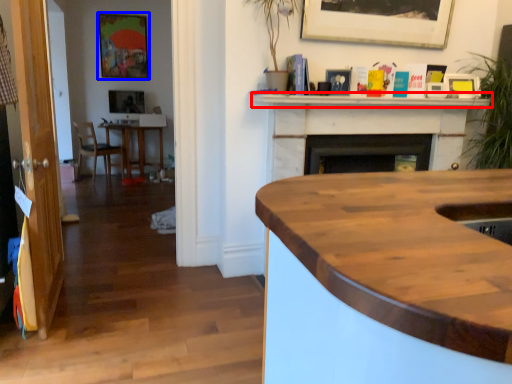
Question: Which object appears farthest to the camera in this image, mantle (highlighted by a red box) or picture frame (highlighted by a blue box)?

Choices:
 (A) mantle
 (B) picture frame

Answer: (B)